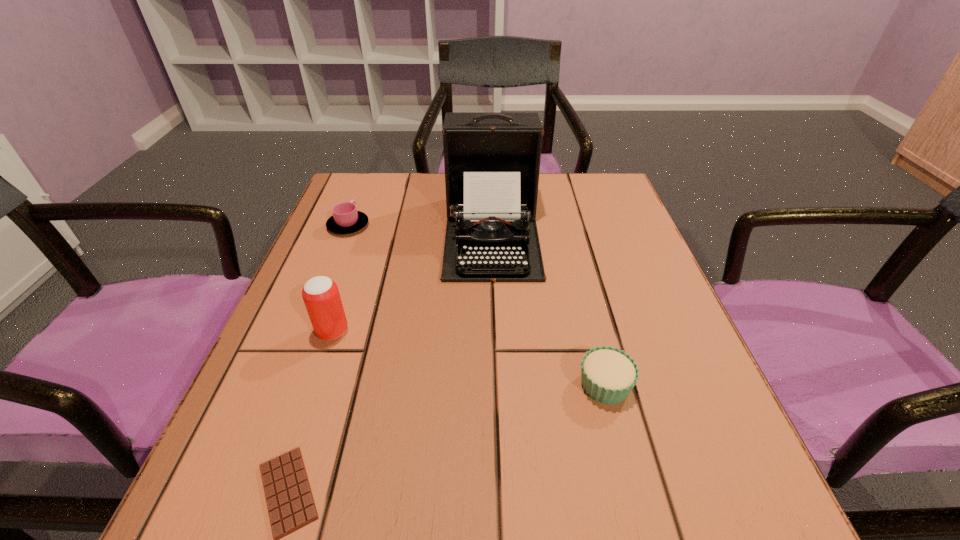
At what (x,y) coordinates should I click in order to perform the action: click on vacant position located on the side with the handle of the cup. Please return your answer as a coordinate pair (x, y). Looking at the image, I should click on (369, 176).

Locate an element on the screen. The image size is (960, 540). free location located 0.180m on the side with the handle of the cup is located at coordinates (367, 179).

This screenshot has width=960, height=540. What are the coordinates of `free region located 0.120m on the left of the rightmost object` in the screenshot? It's located at (503, 384).

Find the location of a particular element. The image size is (960, 540). typewriter located at the far edge is located at coordinates (492, 159).

Locate an element on the screen. This screenshot has width=960, height=540. cup that is at the far edge is located at coordinates (346, 219).

What are the coordinates of `beer can that is at the left edge` in the screenshot? It's located at (320, 294).

Identify the location of cup that is at the left edge. The height and width of the screenshot is (540, 960). (346, 219).

The image size is (960, 540). I want to click on object located at the right edge, so click(608, 375).

I want to click on object that is at the far left corner, so click(x=346, y=219).

The height and width of the screenshot is (540, 960). What are the coordinates of `vacant space at the far edge of the desktop` in the screenshot? It's located at (445, 206).